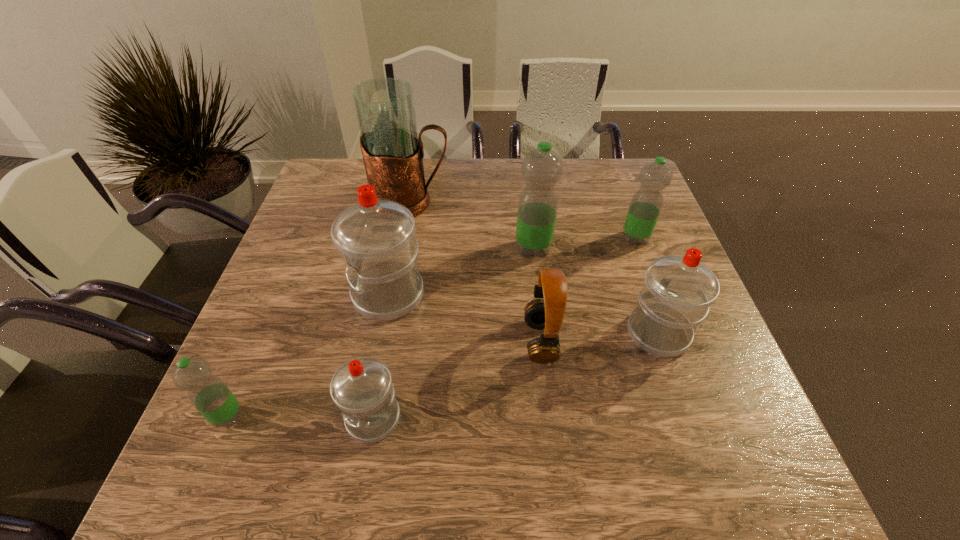
What are the coordinates of `the leftmost water bottle` in the screenshot? It's located at (208, 393).

This screenshot has height=540, width=960. Find the location of `vacant region located with the handle on the side of the farthest object`. vacant region located with the handle on the side of the farthest object is located at coordinates (522, 202).

At what (x,y) coordinates should I click in order to perform the action: click on vacant space situated on the back of the biggest green water bottle. Please return your answer as a coordinate pair (x, y). Looking at the image, I should click on (522, 163).

Where is `free location located 0.120m on the handle side of the biggest white water bottle`? This screenshot has width=960, height=540. free location located 0.120m on the handle side of the biggest white water bottle is located at coordinates (301, 295).

Locate an element on the screen. The width and height of the screenshot is (960, 540). vacant area situated 0.080m on the handle side of the biggest white water bottle is located at coordinates (319, 295).

Locate an element on the screen. The width and height of the screenshot is (960, 540). blank space located on the handle side of the biggest white water bottle is located at coordinates (314, 295).

Locate an element on the screen. Image resolution: width=960 pixels, height=540 pixels. vacant space situated on the front of the rightmost green water bottle is located at coordinates (655, 291).

Locate an element on the screen. The image size is (960, 540). blank space located on the handle side of the second biggest white water bottle is located at coordinates (622, 231).

You are a GUI agent. You are given a task and a screenshot of the screen. Output one action in this format:
    pyautogui.click(x=<x>, y=<y>)
    Task: Click on the vacant space situated 0.320m on the handle side of the second biggest white water bottle
    The height and width of the screenshot is (540, 960).
    Given the screenshot: What is the action you would take?
    pyautogui.click(x=619, y=221)

This screenshot has height=540, width=960. I want to click on free point located on the handle side of the second biggest white water bottle, so click(628, 248).